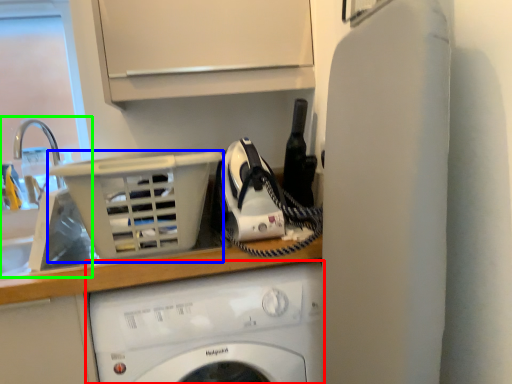
Question: Which object is the closest to the washing machine (highlighted by a red box)? Choose among these: basket (highlighted by a blue box) or sink (highlighted by a green box).

Choices:
 (A) basket
 (B) sink

Answer: (A)